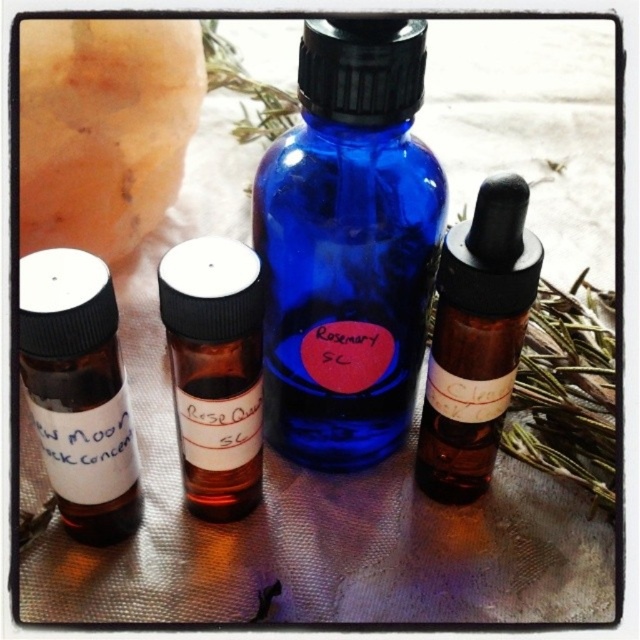
Question: Which point is closer to the camera?

Choices:
 (A) (38, 444)
 (B) (188, 262)
 (C) (440, 380)

Answer: (B)

Question: Which point is closer to the camera?

Choices:
 (A) (241, 454)
 (B) (579, 346)
 (C) (435, 403)
 (D) (285, 435)

Answer: (A)

Question: Is brown glass dropper bottle at right wider than brown glass dropper bottle at center-right?

Choices:
 (A) no
 (B) yes

Answer: (A)

Question: Observing the image, what is the correct spatial positioning of blue glass bottle at center in reference to brown glass dropper bottle at right?

Choices:
 (A) left
 (B) right

Answer: (A)

Question: Is brown glass dropper bottle at right smaller than brown glass dropper bottle at center-right?

Choices:
 (A) yes
 (B) no

Answer: (A)

Question: Which of the following is the closest to the observer?

Choices:
 (A) tap(522, 188)
 (B) tap(324, 212)
 (C) tap(552, 368)
 (D) tap(90, 468)

Answer: (A)